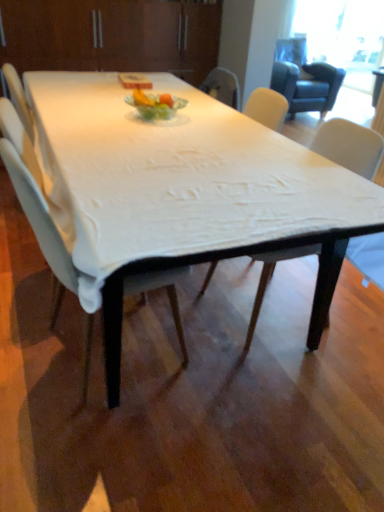
Locate an element on the screen. The height and width of the screenshot is (512, 384). spots to the right of white fabric chair at center, arranged as the 1th chair when viewed from the left is located at coordinates (221, 381).